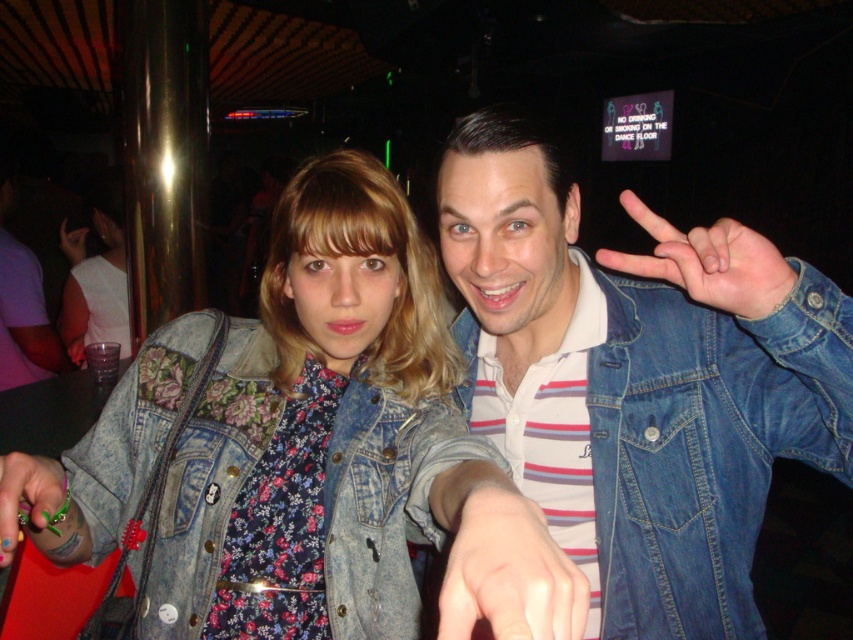
You are a photographer trying to capture a closeup of the floral fabric dress at center and the matte black hand at center in the nightclub scene. Since the camera can only focus on one object at a time, which object should you choose to ensure it fills the frame more effectively?

The floral fabric dress at center is bigger than the matte black hand at center, so you should choose the floral fabric dress at center to fill the frame more effectively.

You are a photographer trying to capture a clear photo of the two denim items mentioned. The camera you are using has a minimum focus distance of 7 inches. Can you focus on both the denim jacket at center and the denim at right simultaneously?

The denim jacket at center is 6.75 inches away from the denim at right. Since the camera requires a minimum focus distance of 7 inches to focus on two objects simultaneously, the distance between them is slightly less than required. Therefore, you cannot focus on both the denim jacket at center and the denim at right at the same time.

In the scene shown: You are a photographer trying to capture a clear shot of both denim jackets in the image. Since the lighting is poor, you decide to adjust your camera focus to the denim at right first. After focusing on that, where should you move the focus next to ensure the faded denim jacket at center is also in focus?

The faded denim jacket at center is below denim at right, so after focusing on denim at right, you should move the focus downward to capture the faded denim jacket at center.